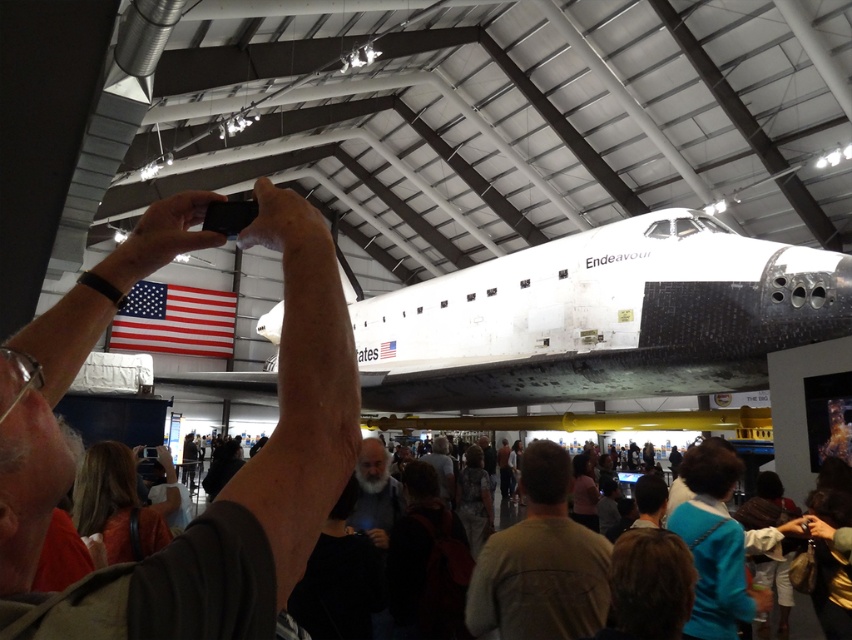
Question: Which point is closer to the camera?

Choices:
 (A) (249, 461)
 (B) (504, 278)

Answer: (A)

Question: Is matte black phone at upper center thinner than white matte space shuttle at center?

Choices:
 (A) yes
 (B) no

Answer: (A)

Question: Among these objects, which one is nearest to the camera?

Choices:
 (A) matte black phone at upper center
 (B) white matte space shuttle at center

Answer: (A)

Question: Is matte black phone at upper center to the right of white matte space shuttle at center from the viewer's perspective?

Choices:
 (A) yes
 (B) no

Answer: (B)

Question: Does matte black phone at upper center have a smaller size compared to white matte space shuttle at center?

Choices:
 (A) yes
 (B) no

Answer: (A)

Question: Which object is farther from the camera taking this photo?

Choices:
 (A) white matte space shuttle at center
 (B) matte black phone at upper center

Answer: (A)